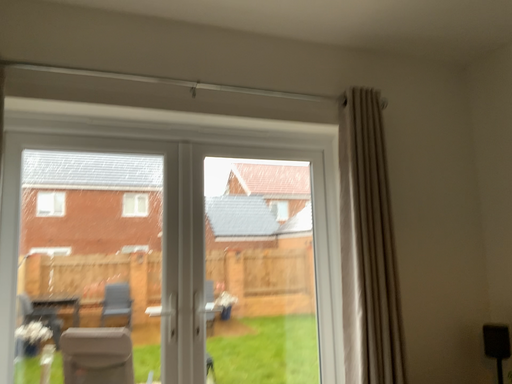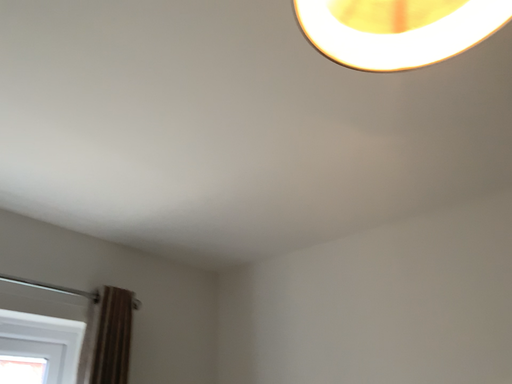
Question: How did the camera likely rotate when shooting the video?

Choices:
 (A) rotated left
 (B) rotated right

Answer: (B)